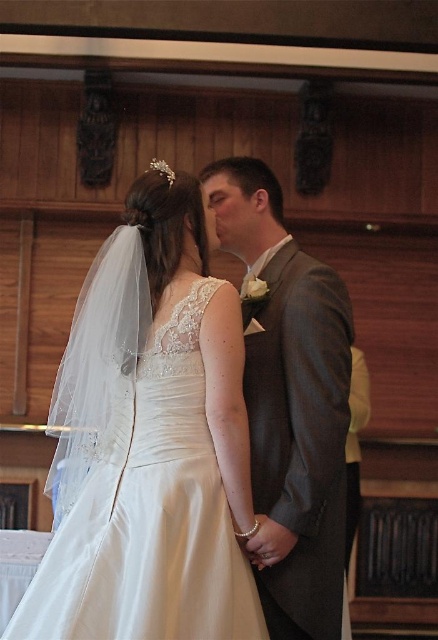
Question: Which of the following is the closest to the observer?

Choices:
 (A) (349, 348)
 (B) (194, 532)

Answer: (B)

Question: Is white satin dress at center closer to the viewer compared to gray textured suit at center?

Choices:
 (A) yes
 (B) no

Answer: (A)

Question: Is white satin dress at center to the left of gray textured suit at center from the viewer's perspective?

Choices:
 (A) no
 (B) yes

Answer: (B)

Question: Which point appears farthest from the camera in this image?

Choices:
 (A) (91, 387)
 (B) (262, 198)

Answer: (B)

Question: Is white satin dress at center to the left of gray textured suit at center from the viewer's perspective?

Choices:
 (A) yes
 (B) no

Answer: (A)